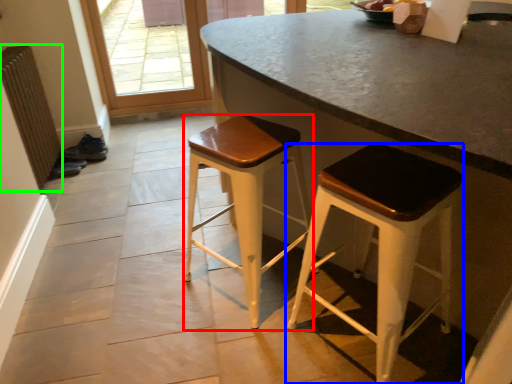
Question: Which object is positioned closest to stool (highlighted by a red box)? Select from stool (highlighted by a blue box) and radiator (highlighted by a green box).

Choices:
 (A) stool
 (B) radiator

Answer: (A)